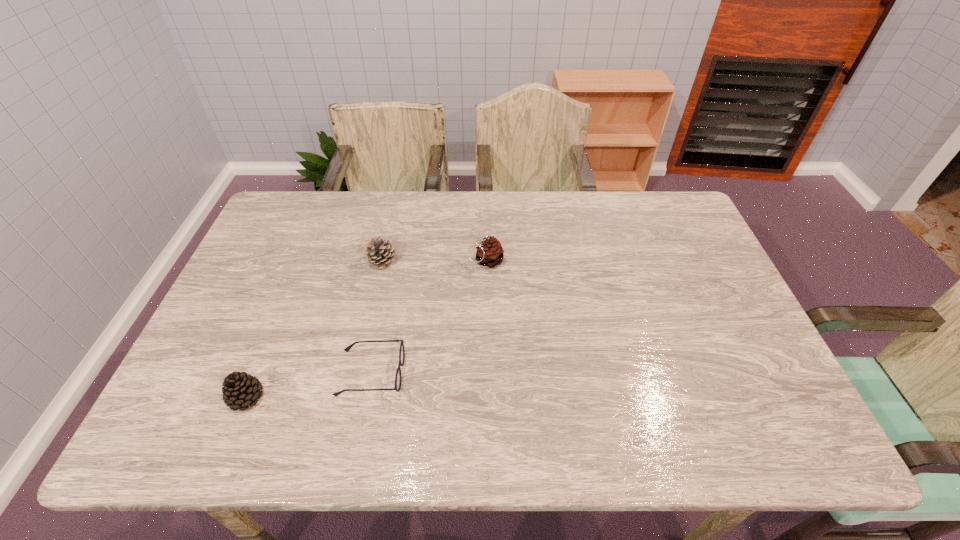
Find the location of `vacant area located on the front-facing side of the shortest object`. vacant area located on the front-facing side of the shortest object is located at coordinates (533, 373).

At what (x,y) coordinates should I click in order to perform the action: click on object present at the near edge. Please return your answer as a coordinate pair (x, y). The height and width of the screenshot is (540, 960). Looking at the image, I should click on (241, 390).

Locate an element on the screen. The width and height of the screenshot is (960, 540). object present at the left edge is located at coordinates [x=241, y=390].

Identify the location of object that is at the near left corner. (241, 390).

Locate an element on the screen. vacant space at the far edge of the desktop is located at coordinates (590, 200).

The image size is (960, 540). In the image, there is a desktop. What are the coordinates of `vacant area at the near edge` in the screenshot? It's located at (373, 441).

The width and height of the screenshot is (960, 540). I want to click on vacant region at the left edge, so click(x=249, y=308).

In the image, there is a desktop. Identify the location of vacant space at the right edge. The height and width of the screenshot is (540, 960). [x=706, y=274].

Where is `vacant space at the far left corner of the desktop`? The height and width of the screenshot is (540, 960). vacant space at the far left corner of the desktop is located at coordinates (279, 197).

The height and width of the screenshot is (540, 960). In the image, there is a desktop. Find the location of `free space at the far right corner`. free space at the far right corner is located at coordinates (678, 203).